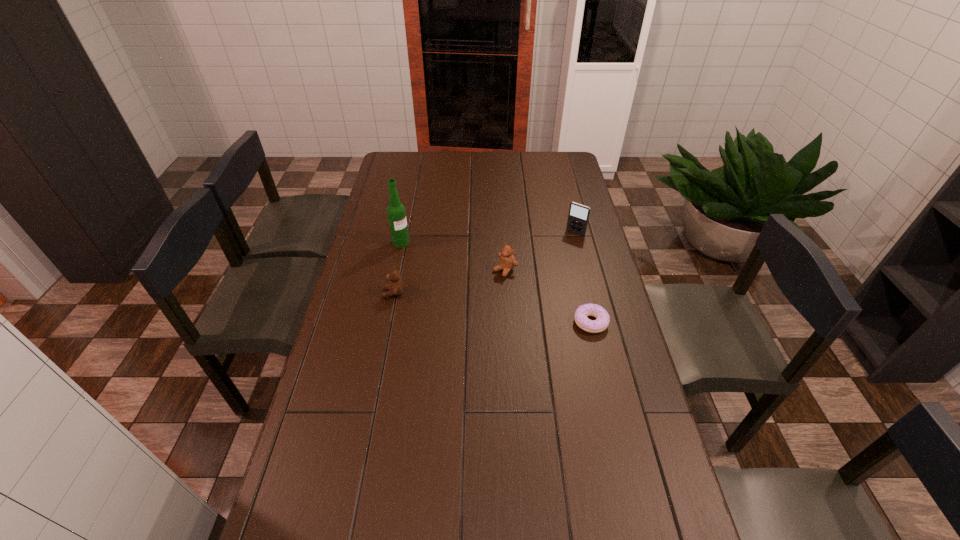
Where is `the left teddy bear`? The height and width of the screenshot is (540, 960). the left teddy bear is located at coordinates pyautogui.click(x=395, y=288).

Find the location of a particular element. This screenshot has height=540, width=960. the fourth farthest object is located at coordinates [395, 288].

Find the location of a particular element. This screenshot has height=540, width=960. the shortest object is located at coordinates (602, 320).

The height and width of the screenshot is (540, 960). Identify the location of doughnut. (602, 320).

Identify the location of the farthest object. (578, 217).

Where is `iPod`? iPod is located at coordinates (578, 217).

Locate an element on the screen. the right teddy bear is located at coordinates (507, 262).

Find the location of `the third object from right to left`. the third object from right to left is located at coordinates (507, 262).

Find the location of a particular element. This screenshot has height=540, width=960. the tallest object is located at coordinates (396, 213).

You are a GUI agent. You are given a task and a screenshot of the screen. Output one action in this format:
    pyautogui.click(x=<x>, y=<y>)
    Task: Click on the beer bottle
    Image resolution: width=960 pixels, height=540 pixels.
    Given the screenshot: What is the action you would take?
    pyautogui.click(x=396, y=213)